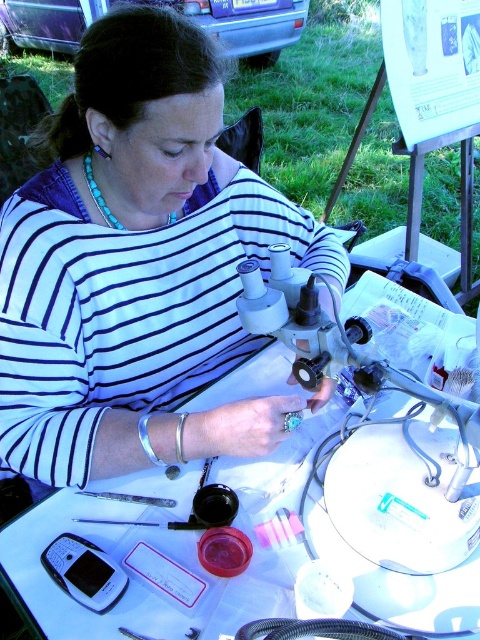
Does white striped shirt at center lie in front of white plastic table at center?

No, it is behind white plastic table at center.

Which of these two, white striped shirt at center or white plastic table at center, stands shorter?

white plastic table at center

Does point (253, 449) come behind point (99, 628)?

Yes, point (253, 449) is behind point (99, 628).

Find the location of a particular element. white striped shirt at center is located at coordinates coord(137,266).